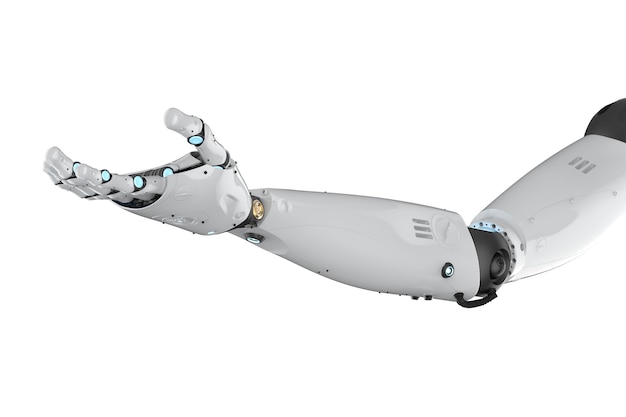
You are a GUI agent. You are given a task and a screenshot of the screen. Output one action in this format:
    pyautogui.click(x=<x>, y=<y>)
    Task: Click on the screws
    The image size is (626, 417).
    Given the screenshot: What is the action you would take?
    pyautogui.click(x=255, y=208)